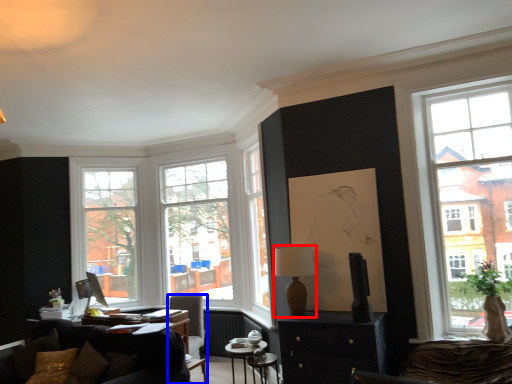
Question: Among these objects, which one is farthest to the camera, lamp (highlighted by a red box) or chair (highlighted by a blue box)?

Choices:
 (A) lamp
 (B) chair

Answer: (B)